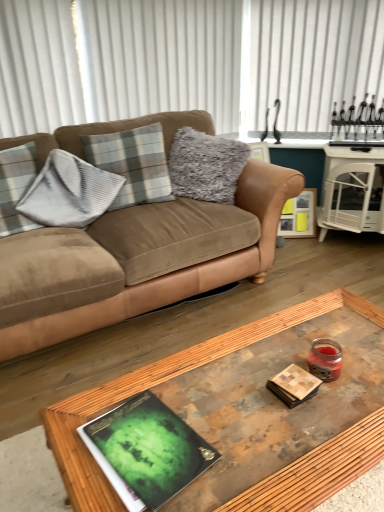
In order to click on free location in front of matte brown book at center in this screenshot , I will do `click(311, 439)`.